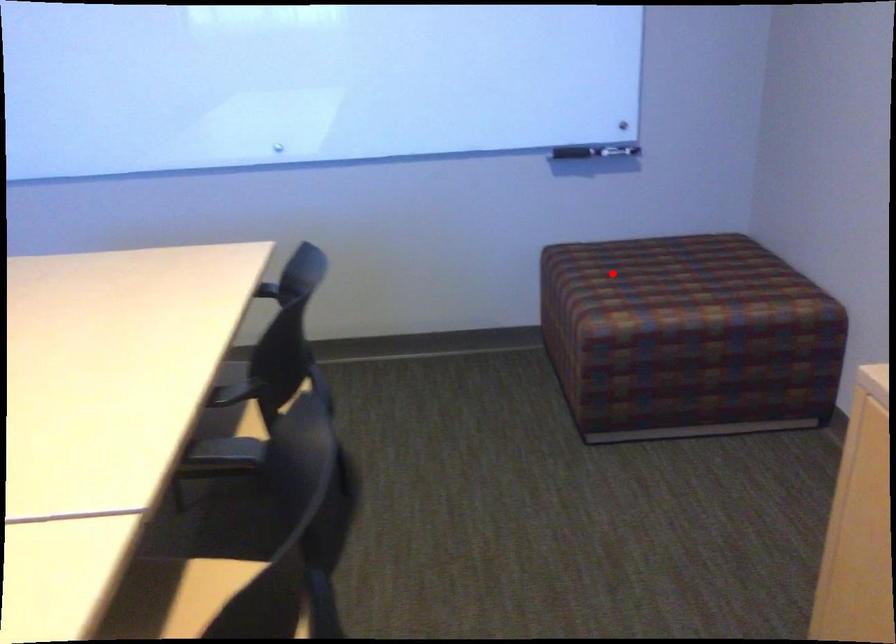
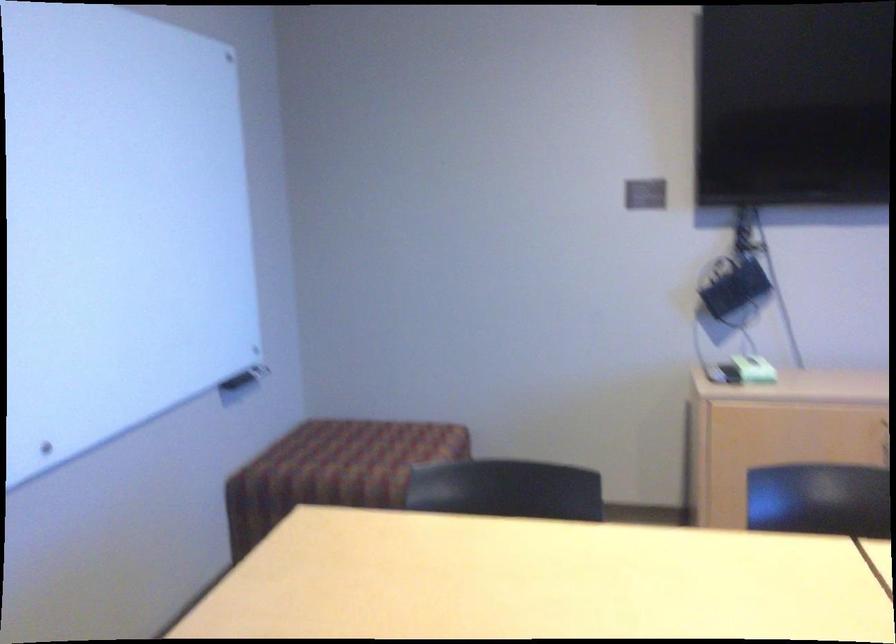
Where in the second image is the point corresponding to the highlighted location from the first image?

(331, 465)